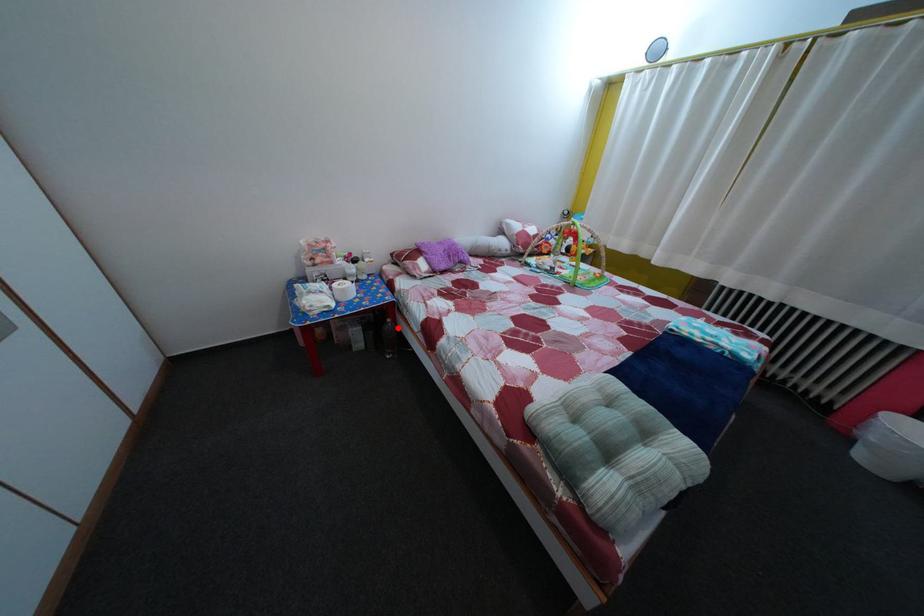
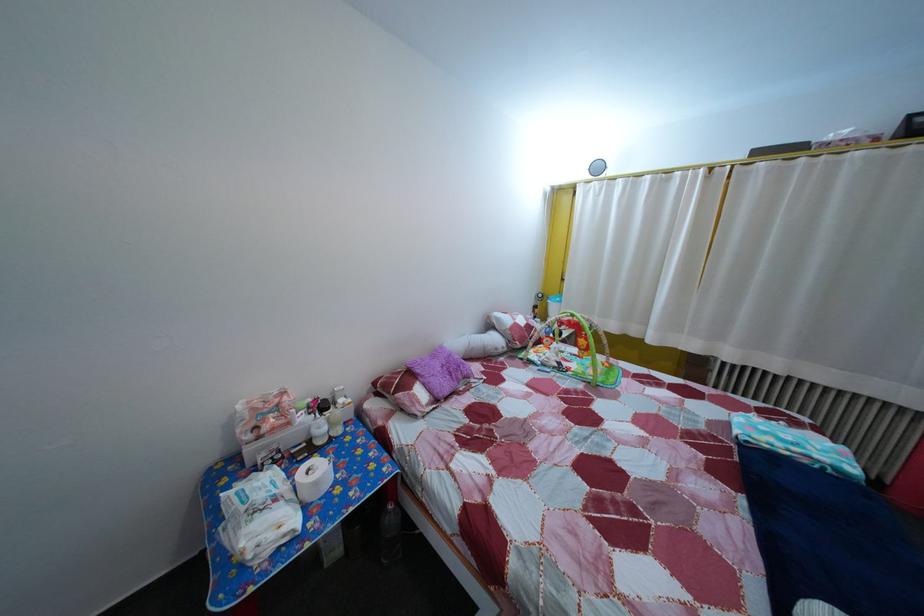
Find the pixel in the second image that matches the highlighted location in the first image.

(399, 515)